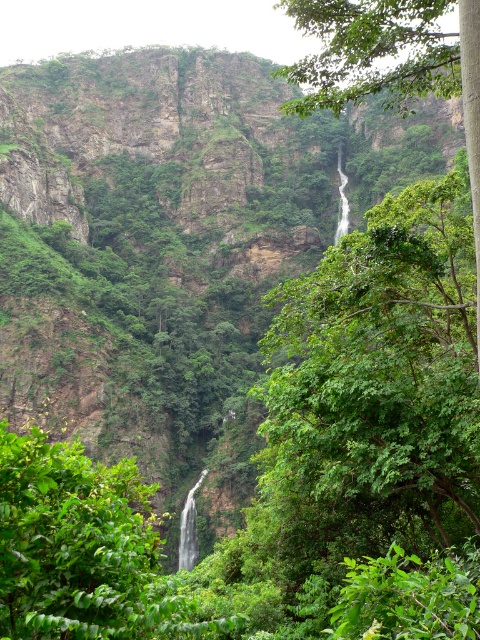
Question: Which of the following is the farthest from the observer?

Choices:
 (A) white smooth waterfall at center
 (B) green leafy tree at upper center

Answer: (A)

Question: Does green leafy tree at upper center appear over white smooth waterfall at center?

Choices:
 (A) no
 (B) yes

Answer: (B)

Question: Is green leafy tree at upper center bigger than white smooth waterfall at center?

Choices:
 (A) yes
 (B) no

Answer: (A)

Question: Which object appears closest to the camera in this image?

Choices:
 (A) white smooth waterfall at center
 (B) green leafy tree at upper center

Answer: (B)

Question: Is green leafy tree at upper center in front of white smooth waterfall at center?

Choices:
 (A) no
 (B) yes

Answer: (B)